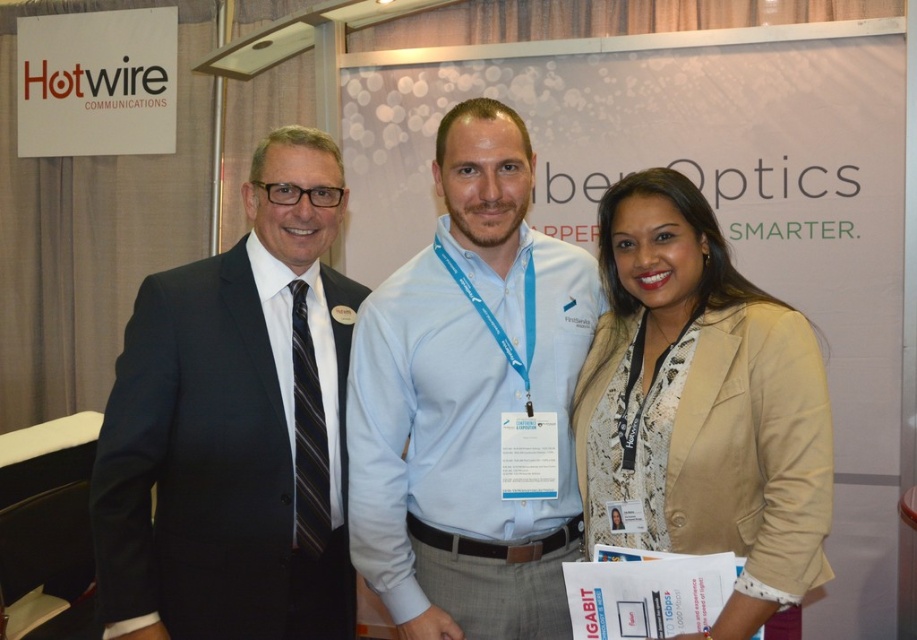
Does white paperboard at center appear on the right side of light blue jersey at center?

Indeed, white paperboard at center is positioned on the right side of light blue jersey at center.

Is white paperboard at center to the left of light blue jersey at center from the viewer's perspective?

Incorrect, white paperboard at center is not on the left side of light blue jersey at center.

Is point (681, 141) farther from viewer compared to point (429, 324)?

Yes, it is.

You are a GUI agent. You are given a task and a screenshot of the screen. Output one action in this format:
    pyautogui.click(x=<x>, y=<y>)
    Task: Click on the white paperboard at center
    
    Given the screenshot: What is the action you would take?
    click(706, 196)

Can you confirm if black suit at left is positioned to the right of beige textured blazer at center?

No, black suit at left is not to the right of beige textured blazer at center.

In the scene shown: Who is more forward, (242, 321) or (775, 438)?

Point (775, 438)

Where is `black suit at left`? The image size is (917, 640). black suit at left is located at coordinates (235, 426).

Between black suit at left and light blue jersey at center, which one appears on the left side from the viewer's perspective?

black suit at left is more to the left.

Does black suit at left appear on the left side of light blue jersey at center?

Indeed, black suit at left is positioned on the left side of light blue jersey at center.

Is point (131, 596) positioned behind point (385, 513)?

No.

Find the location of `black suit at left`. black suit at left is located at coordinates (235, 426).